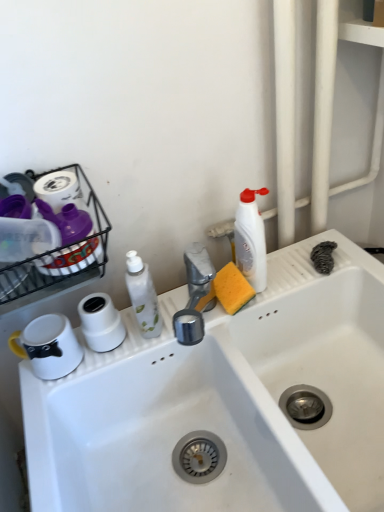
Locate an element on the screen. vacant space in front of white glossy mug at left is located at coordinates (46, 414).